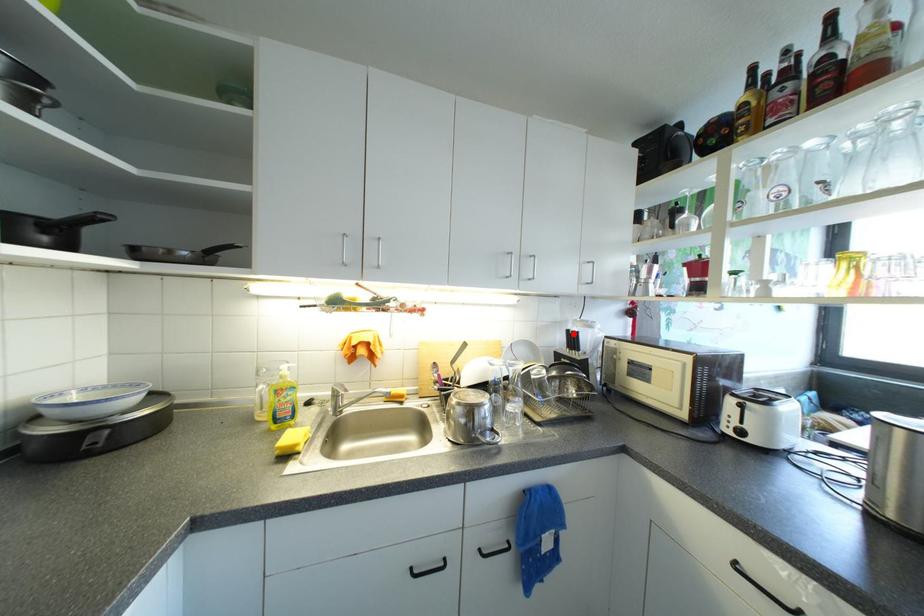
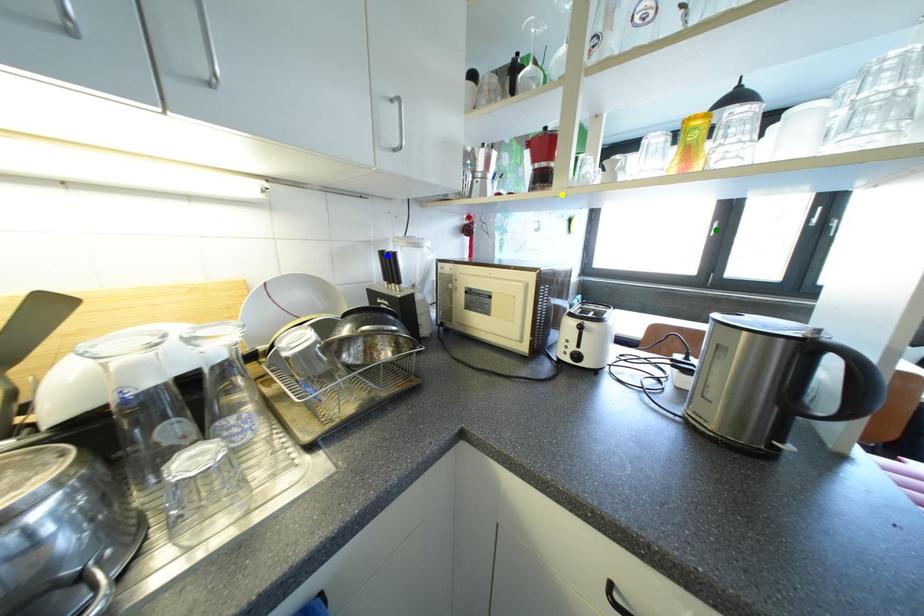
Question: I am providing you with two images of the same scene from different viewpoints. A red point is marked on the first image. You are given multiple points on the second image. In image 2, which mark is for the same physical point as the one in image 1?

Choices:
 (A) blue point
 (B) green point
 (C) yellow point

Answer: (A)